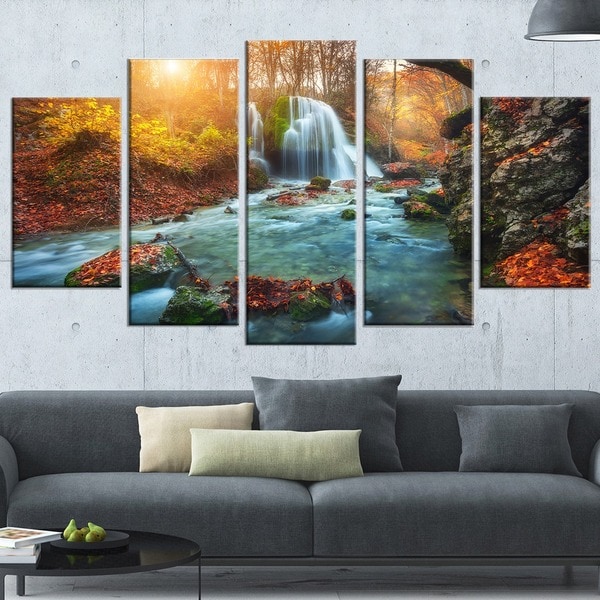
At what (x,y) coordinates should I click in order to perform the action: click on right couch cushion. Please return your answer as a coordinate pair (x, y). Looking at the image, I should click on (219, 510).